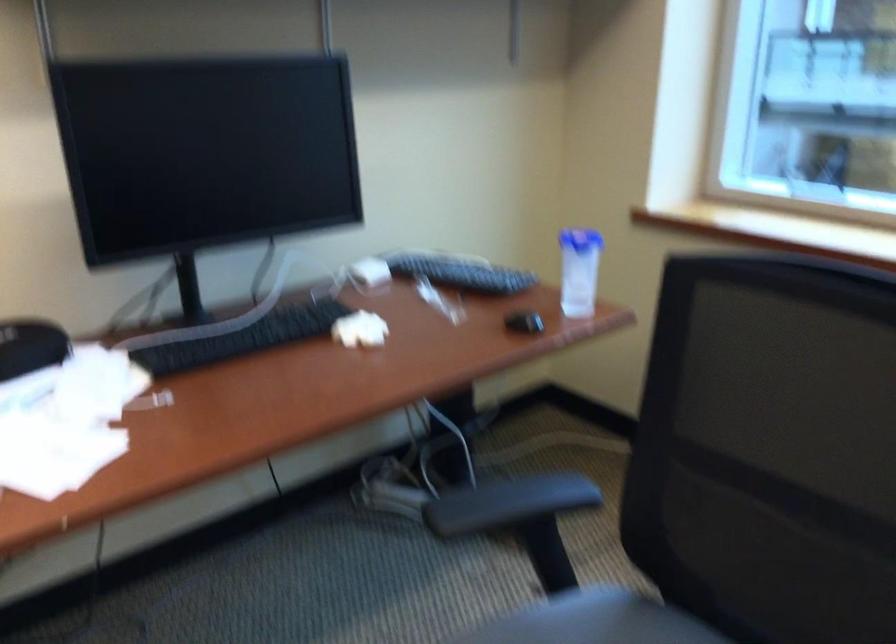
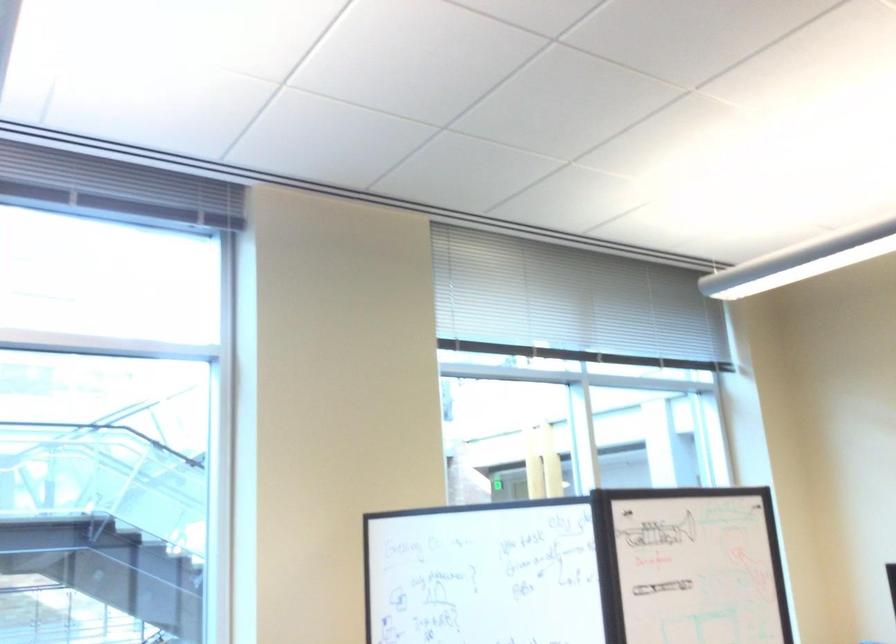
From the picture: Based on the continuous images, in which direction is the camera rotating?

The rotation direction of the camera is right-up.